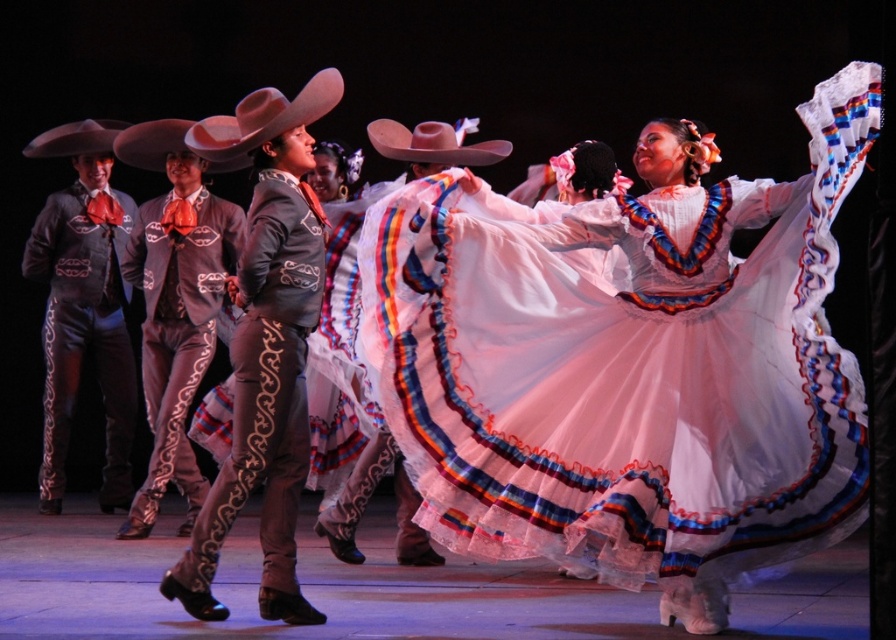
You are a photographer at a cultural event and want to capture a photo of the gray satin suit at center and the matte pink cowboy hat at center. Which object is located to the left of the other?

The gray satin suit at center is positioned on the left side of matte pink cowboy hat at center.